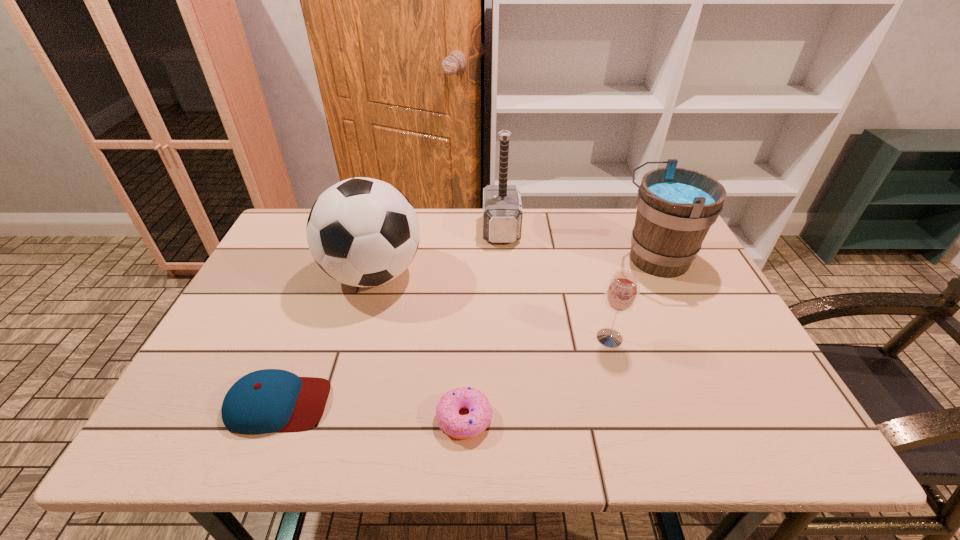
Locate an element on the screen. The height and width of the screenshot is (540, 960). vacant position located on the front of the soccer ball is located at coordinates (359, 325).

The width and height of the screenshot is (960, 540). In order to click on vacant space located 0.180m with a handle on the side of the rightmost object in this screenshot , I will do `click(553, 259)`.

You are a GUI agent. You are given a task and a screenshot of the screen. Output one action in this format:
    pyautogui.click(x=<x>, y=<y>)
    Task: Click on the vacant space located with a handle on the side of the rightmost object
    The width and height of the screenshot is (960, 540).
    Given the screenshot: What is the action you would take?
    pyautogui.click(x=546, y=259)

This screenshot has height=540, width=960. Find the location of `vacant space located 0.120m with a handle on the side of the rightmost object`. vacant space located 0.120m with a handle on the side of the rightmost object is located at coordinates (573, 259).

Locate an element on the screen. This screenshot has height=540, width=960. vacant space located 0.340m on the back of the wineglass is located at coordinates (583, 245).

You are a GUI agent. You are given a task and a screenshot of the screen. Output one action in this format:
    pyautogui.click(x=<x>, y=<y>)
    Task: Click on the vacant space located 0.080m with the bill of the second shortest object facing forward
    The width and height of the screenshot is (960, 540).
    Given the screenshot: What is the action you would take?
    pyautogui.click(x=366, y=403)

Identify the location of vacant position located 0.070m on the left of the shortest object. (403, 418).

Find the location of a particular element. Image resolution: width=960 pixels, height=540 pixels. hammer positioned at the far edge is located at coordinates (502, 209).

This screenshot has width=960, height=540. In order to click on soccer ball at the far edge in this screenshot , I will do `click(363, 232)`.

Locate an element on the screen. wine bucket that is positioned at the far edge is located at coordinates (676, 207).